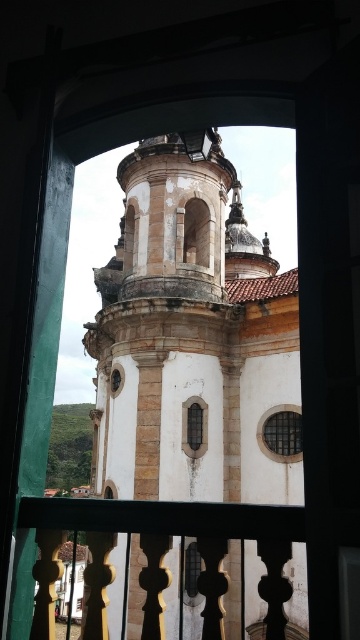
You are standing on the balcony of the historic church and want to move from the polished wood railing at center to the clear glass window at center. Given that you have a 1.2 meter wide wheelchair, can you navigate the space between them?

The distance between the polished wood railing at center and the clear glass window at center is 15.13 meters, which is more than enough space for a wheelchair that is 1.2 meters wide to navigate safely between them.

You are standing on the balcony and looking through the arched doorway at the historic church. There are two points marked in the image. The first point is located at coordinates point (x=245, y=529) and the second at point (x=186, y=440). Which of these points is nearer to your vantage point on the balcony?

Point (x=245, y=529) is closer to the viewer than point (x=186, y=440).

You are standing on a balcony overlooking the church. You see the polished wood railing at center and the metallic grid window at center. Which object is closer to you?

The polished wood railing at center is closer to you because it is positioned below the metallic grid window at center, indicating it is in front of the window from your viewpoint.